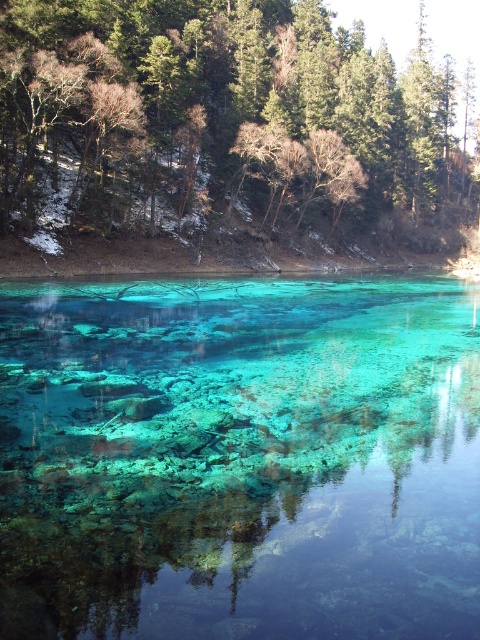
You are standing at the edge of the lake and want to find the translucent teal water at center. According to the coordinates provided, where should you look relative to your position?

The translucent teal water at center is located at point 0.716 on the horizontal axis and 0.500 on the vertical axis, so you should look towards the middle of the lake, slightly to the right from your current position at the edge.

You are standing on the lakeshore and want to take a photo of both the translucent teal water at center and the green leafy tree at upper center. Which object will appear larger in your camera viewfinder?

The translucent teal water at center will appear larger in the camera viewfinder because it is closer to the viewer than the green leafy tree at upper center.